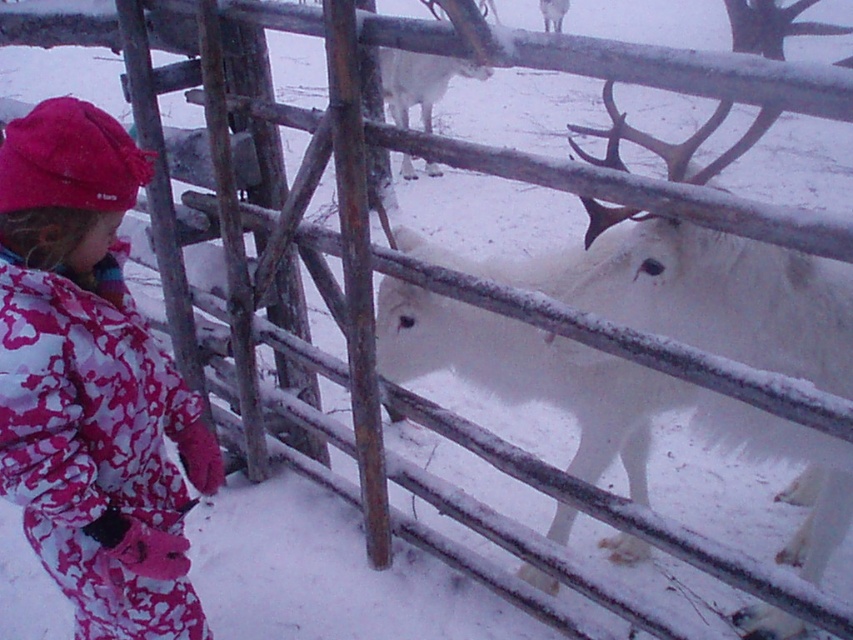
Question: Which point appears farthest from the camera in this image?

Choices:
 (A) (753, 300)
 (B) (631, 547)

Answer: (B)

Question: Which of the following is the closest to the observer?

Choices:
 (A) white furry deer at right
 (B) white fluffy reindeer at center

Answer: (A)

Question: Among these objects, which one is nearest to the camera?

Choices:
 (A) white fluffy reindeer at center
 (B) fluffy pink snowsuit at left
 (C) white furry deer at right

Answer: (B)

Question: Is white fluffy reindeer at center thinner than white furry deer at right?

Choices:
 (A) yes
 (B) no

Answer: (A)

Question: Does fluffy pink snowsuit at left appear on the right side of white furry deer at right?

Choices:
 (A) no
 (B) yes

Answer: (A)

Question: Observing the image, what is the correct spatial positioning of fluffy pink snowsuit at left in reference to white furry deer at right?

Choices:
 (A) left
 (B) right

Answer: (A)